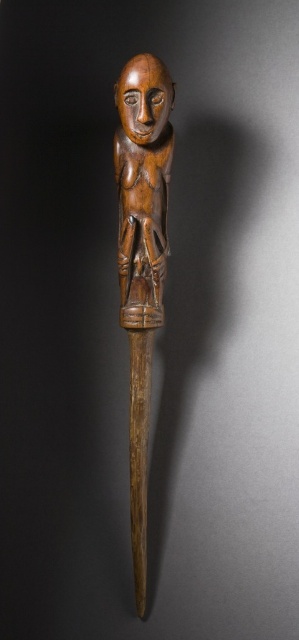
Question: Can you confirm if wooden carving at center is positioned below wooden figurine at center?

Choices:
 (A) no
 (B) yes

Answer: (B)

Question: Does wooden carving at center have a lesser width compared to wooden figurine at center?

Choices:
 (A) no
 (B) yes

Answer: (B)

Question: Which of the following is the closest to the observer?

Choices:
 (A) (144, 308)
 (B) (162, 310)

Answer: (A)

Question: Among these points, which one is nearest to the camera?

Choices:
 (A) (160, 186)
 (B) (135, 563)

Answer: (A)

Question: Is wooden carving at center below wooden figurine at center?

Choices:
 (A) yes
 (B) no

Answer: (A)